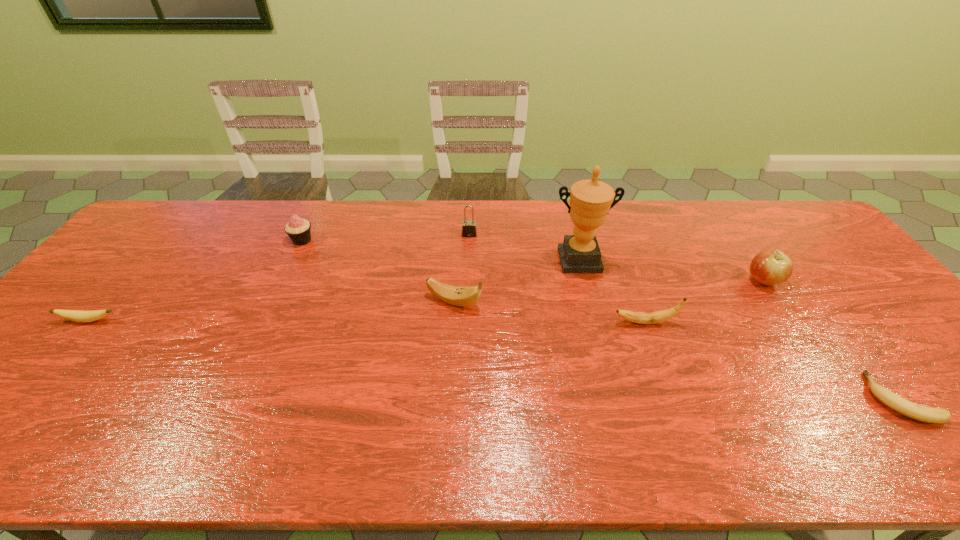
The image size is (960, 540). In order to click on the tallest object in this screenshot , I will do `click(590, 200)`.

Where is `padlock`? padlock is located at coordinates (469, 229).

The height and width of the screenshot is (540, 960). Find the location of `the third banana from right to left`. the third banana from right to left is located at coordinates (458, 296).

Where is `the seventh object from right to left`? the seventh object from right to left is located at coordinates (298, 229).

The height and width of the screenshot is (540, 960). In order to click on the seventh object from left to right in this screenshot , I will do `click(770, 267)`.

Locate an element on the screen. the second banana from right to left is located at coordinates (x=659, y=316).

Where is `the third tallest banana`? the third tallest banana is located at coordinates (74, 315).

This screenshot has height=540, width=960. Identify the location of the leftmost object. (74, 315).

Locate an element on the screen. the rightmost object is located at coordinates (915, 411).

Identify the location of the rightmost banana. (915, 411).